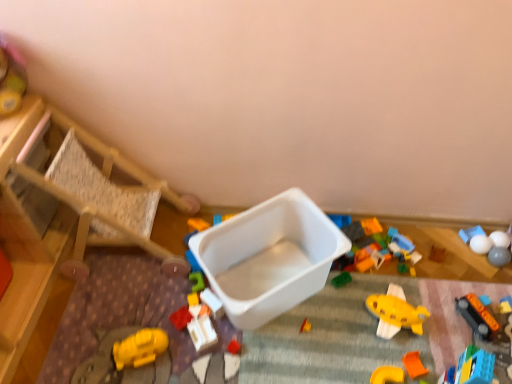
I want to click on free space that is to the left of orange matte plastic toy at lower right, the 10th toy viewed from the right, so click(327, 359).